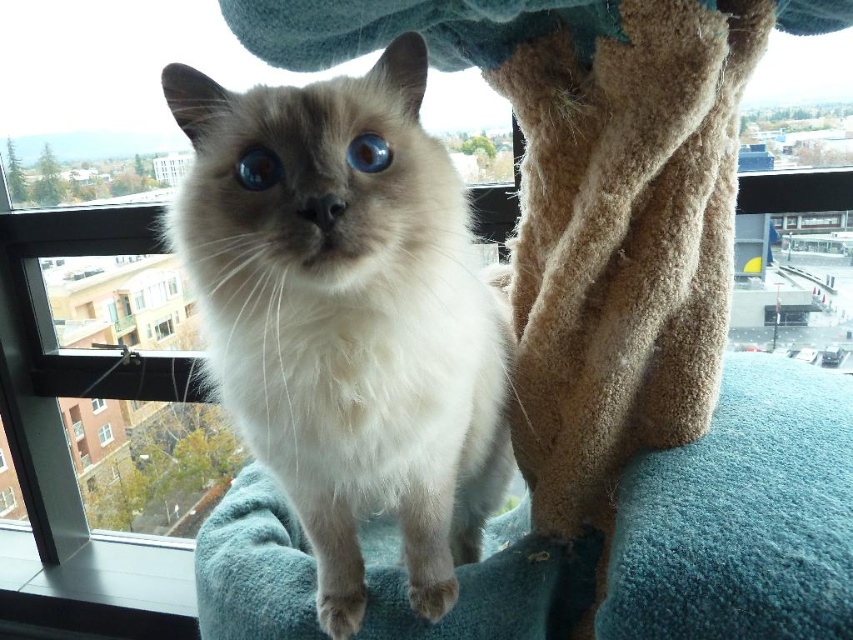
You are a cat sitting on the cat tree and want to look outside through the clear glass window at center. Where exactly should you look to see the cityscape outside?

The clear glass window at center is located at the 2D coordinates point (123,305), so you should look towards that point to see the cityscape outside.

You are a photographer standing in the room where the cat is. You want to take a photo of the cat so that the point at coordinate (347, 316) is visible in the frame. Is the point on the cat or somewhere else?

The point at coordinate (347, 316) is on the white fluffy cat at center, so it will be visible in the photo.